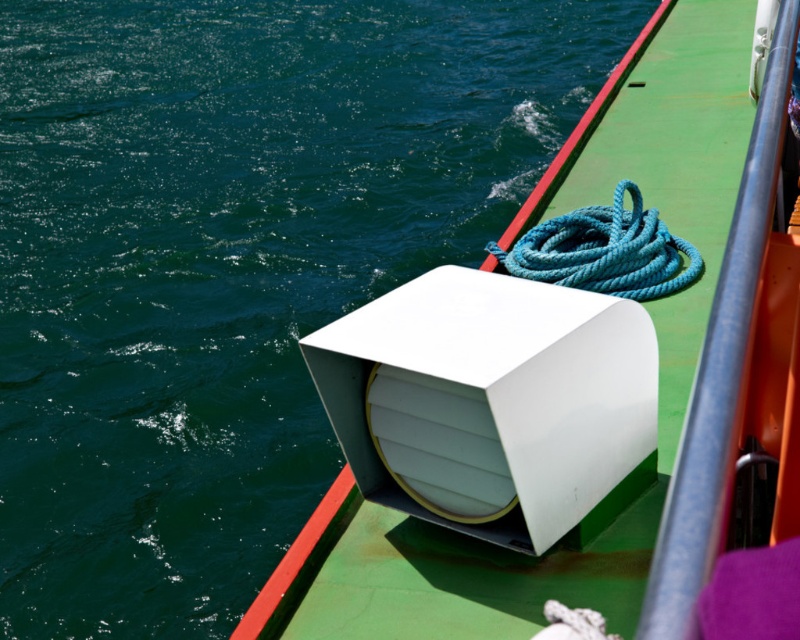
Can you confirm if white matte speaker at center is smaller than teal rope at upper right?

Actually, white matte speaker at center might be larger than teal rope at upper right.

Between point (400, 428) and point (658, 218), which one is positioned in front?

Point (400, 428) is more forward.

I want to click on white matte speaker at center, so click(x=574, y=380).